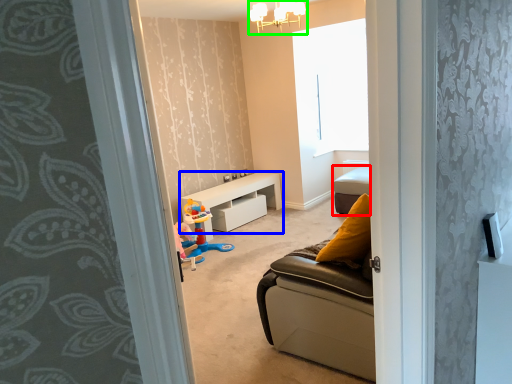
Question: Which object is positioned closest to furniture (highlighted by a red box)? Select from table (highlighted by a blue box) and light fixture (highlighted by a green box).

Choices:
 (A) table
 (B) light fixture

Answer: (A)